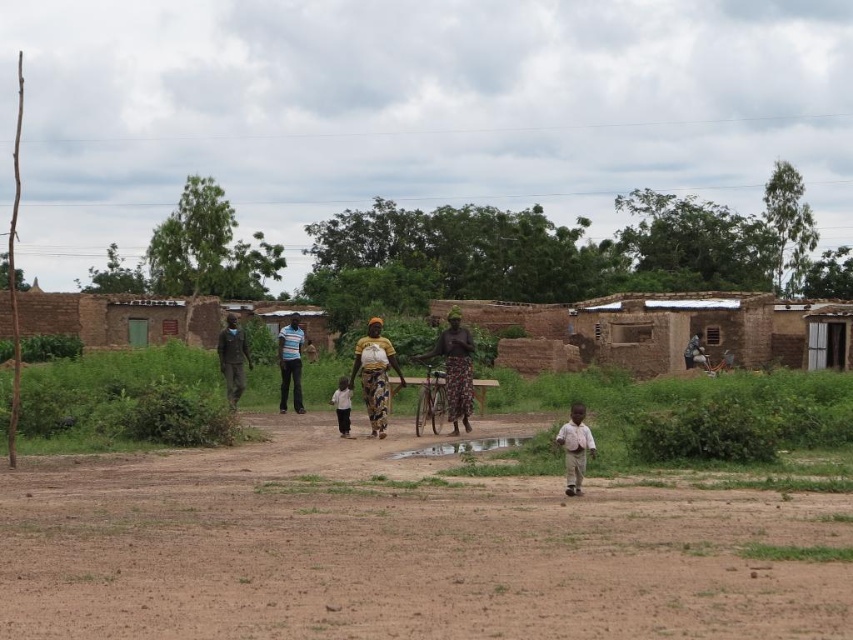
Question: Can you confirm if striped cotton shirt at center is positioned to the right of shiny reflective puddle at center?

Choices:
 (A) no
 (B) yes

Answer: (A)

Question: Which is nearer to the dark brown wooden chair at right?

Choices:
 (A) light brown cotton shirt at lower right
 (B) brown mud huts at center
 (C) patterned fabric dress at center

Answer: (B)

Question: Can you confirm if brown soil at lower center is thinner than dark blue fabric shirt at left?

Choices:
 (A) no
 (B) yes

Answer: (A)

Question: Does light brown cotton shirt at lower right appear under dark brown wooden chair at right?

Choices:
 (A) yes
 (B) no

Answer: (A)

Question: Which point is closer to the camera taking this photo?

Choices:
 (A) (576, 428)
 (B) (515, 438)
 (C) (224, 369)

Answer: (A)

Question: Which of these objects is positioned closest to the yellow printed fabric at center?

Choices:
 (A) white cotton shirt at center
 (B) brown mud huts at center

Answer: (A)